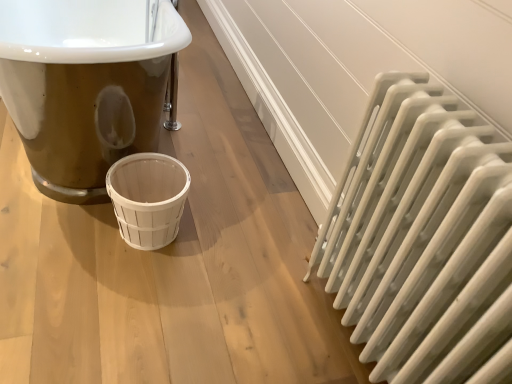
Describe the element at coordinates (148, 198) in the screenshot. I see `white wood basket at center` at that location.

The width and height of the screenshot is (512, 384). Identify the location of white wood basket at center. (148, 198).

In order to face white wood basket at center, should I rotate leftwards or rightwards?

It's best to rotate left around 13.616 degrees.

What is the approximate height of white wood basket at center?

It is 28.93 centimeters.

Measure the distance between white wood basket at center and camera.

A distance of 1.38 meters exists between white wood basket at center and camera.

This screenshot has height=384, width=512. What do you see at coordinates (422, 237) in the screenshot?
I see `white matte radiator at right` at bounding box center [422, 237].

At what (x,y) coordinates should I click in order to perform the action: click on white matte radiator at right. Please return your answer as a coordinate pair (x, y). Image resolution: width=512 pixels, height=384 pixels. Looking at the image, I should click on (422, 237).

In order to face white matte radiator at right, should I rotate leftwards or rightwards?

Turn right by 20.157 degrees to look at white matte radiator at right.

Identify the location of white wood basket at center. The width and height of the screenshot is (512, 384). (148, 198).

In the scene shown: Can you confirm if white matte radiator at right is positioned to the right of white wood basket at center?

Correct, you'll find white matte radiator at right to the right of white wood basket at center.

Which object is closer to the camera taking this photo, white matte radiator at right or white wood basket at center?

white matte radiator at right is in front.

Does point (438, 269) appear closer or farther from the camera than point (164, 220)?

Point (438, 269).

From the image's perspective, between white matte radiator at right and white wood basket at center, which one is located above?

white wood basket at center, from the image's perspective.

From a real-world perspective, which is physically below, white matte radiator at right or white wood basket at center?

white wood basket at center.

Consider the image. Which object is thinner, white matte radiator at right or white wood basket at center?

white matte radiator at right.

From their relative heights in the image, would you say white matte radiator at right is taller or shorter than white wood basket at center?

white matte radiator at right is taller than white wood basket at center.

Which of these two, white matte radiator at right or white wood basket at center, is smaller?

white wood basket at center is smaller.

Consider the image. Is white matte radiator at right surrounding white wood basket at center?

No, white wood basket at center is not surrounded by white matte radiator at right.

Is white matte radiator at right far away from white wood basket at center?

No.

Could you tell me if white matte radiator at right is turned towards white wood basket at center?

No, white matte radiator at right is not facing towards white wood basket at center.

Where is `radiator that appears on the right of white wood basket at center`? radiator that appears on the right of white wood basket at center is located at coordinates (422, 237).

Is white wood basket at center at the left side of white matte radiator at right?

Yes.

Is white wood basket at center in front of or behind white matte radiator at right in the image?

white wood basket at center is positioned farther from the viewer than white matte radiator at right.

Between point (154, 242) and point (398, 300), which one is positioned behind?

Positioned behind is point (154, 242).

Based on the photo, from the image's perspective, which one is positioned lower, white wood basket at center or white matte radiator at right?

white matte radiator at right appears lower in the image.

From the picture: From a real-world perspective, between white wood basket at center and white matte radiator at right, who is vertically lower?

white wood basket at center is physically lower.

Based on the photo, which of these two, white wood basket at center or white matte radiator at right, is thinner?

white matte radiator at right is thinner.

Can you confirm if white wood basket at center is taller than white matte radiator at right?

In fact, white wood basket at center may be shorter than white matte radiator at right.

Based on their sizes in the image, would you say white wood basket at center is bigger or smaller than white matte radiator at right?

white wood basket at center is smaller than white matte radiator at right.

Is white wood basket at center spatially inside white matte radiator at right, or outside of it?

white wood basket at center cannot be found inside white matte radiator at right.

Is white wood basket at center far away from white matte radiator at right?

They are positioned close to each other.

From the picture: Could you tell me if white wood basket at center is turned towards white matte radiator at right?

No, white wood basket at center is not aimed at white matte radiator at right.

How distant is white wood basket at center from white matte radiator at right?

white wood basket at center and white matte radiator at right are 28.93 inches apart from each other.

At what (x,y) coordinates should I click in order to perform the action: click on radiator that is below the white wood basket at center (from the image's perspective). Please return your answer as a coordinate pair (x, y). This screenshot has width=512, height=384. Looking at the image, I should click on (422, 237).

The width and height of the screenshot is (512, 384). In order to click on radiator in front of the white wood basket at center in this screenshot , I will do `click(422, 237)`.

Where is `radiator below the white wood basket at center (from the image's perspective)`? The image size is (512, 384). radiator below the white wood basket at center (from the image's perspective) is located at coordinates (422, 237).